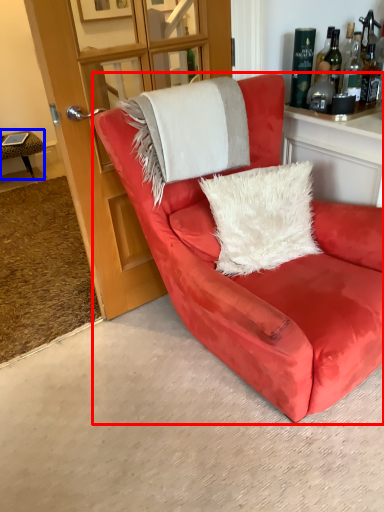
Question: Which object appears farthest to the camera in this image, chair (highlighted by a red box) or table (highlighted by a blue box)?

Choices:
 (A) chair
 (B) table

Answer: (B)